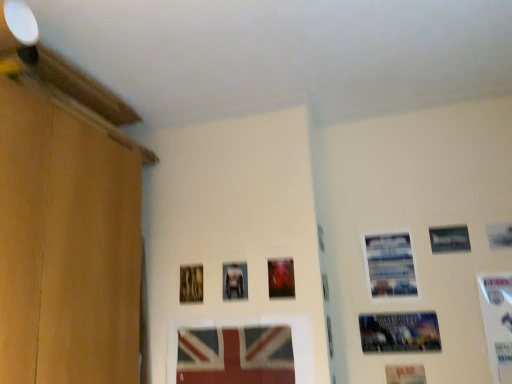
Question: Is matte plastic picture frame at center, the 8th picture frame positioned from the right, oriented away from metallic silver picture frame at center, which is counted as the third picture frame, starting from the left?

Choices:
 (A) no
 (B) yes

Answer: (A)

Question: Is the position of matte plastic picture frame at center, which is the 2th picture frame in left-to-right order, less distant than that of metallic silver picture frame at center, the 7th picture frame from the right?

Choices:
 (A) no
 (B) yes

Answer: (B)

Question: Considering the relative sizes of matte plastic picture frame at center, which is the 2th picture frame in left-to-right order, and metallic silver picture frame at center, which is counted as the third picture frame, starting from the left, in the image provided, is matte plastic picture frame at center, which is the 2th picture frame in left-to-right order, wider than metallic silver picture frame at center, which is counted as the third picture frame, starting from the left,?

Choices:
 (A) no
 (B) yes

Answer: (A)

Question: Is the position of matte plastic picture frame at center, the 8th picture frame positioned from the right, more distant than that of metallic silver picture frame at center, which is counted as the third picture frame, starting from the left?

Choices:
 (A) yes
 (B) no

Answer: (B)

Question: Does matte plastic picture frame at center, the 8th picture frame positioned from the right, have a lesser height compared to metallic silver picture frame at center, which is counted as the third picture frame, starting from the left?

Choices:
 (A) yes
 (B) no

Answer: (B)

Question: Is matte plastic picture frame at center, the 8th picture frame positioned from the right, spatially inside white glossy picture frame at right, which is counted as the ninth picture frame, starting from the left, or outside of it?

Choices:
 (A) outside
 (B) inside

Answer: (A)

Question: Considering the positions of matte plastic picture frame at center, the 8th picture frame positioned from the right, and white glossy picture frame at right, the first picture frame positioned from the right, in the image, is matte plastic picture frame at center, the 8th picture frame positioned from the right, wider or thinner than white glossy picture frame at right, the first picture frame positioned from the right,?

Choices:
 (A) wide
 (B) thin

Answer: (B)

Question: From their relative heights in the image, would you say matte plastic picture frame at center, the 8th picture frame positioned from the right, is taller or shorter than white glossy picture frame at right, which is counted as the ninth picture frame, starting from the left?

Choices:
 (A) short
 (B) tall

Answer: (A)

Question: Based on their positions, is matte plastic picture frame at center, the 8th picture frame positioned from the right, located to the left or right of white glossy picture frame at right, which is counted as the ninth picture frame, starting from the left?

Choices:
 (A) left
 (B) right

Answer: (A)

Question: Based on their positions, is metallic silver picture frame at center, the 7th picture frame from the right, located to the left or right of metallic silver picture frame at upper right, the 7th picture frame from the left?

Choices:
 (A) left
 (B) right

Answer: (A)

Question: Considering the positions of metallic silver picture frame at center, which is counted as the third picture frame, starting from the left, and metallic silver picture frame at upper right, the 3th picture frame in the right-to-left sequence, in the image, is metallic silver picture frame at center, which is counted as the third picture frame, starting from the left, taller or shorter than metallic silver picture frame at upper right, the 3th picture frame in the right-to-left sequence,?

Choices:
 (A) short
 (B) tall

Answer: (B)

Question: In terms of size, does metallic silver picture frame at center, the 7th picture frame from the right, appear bigger or smaller than metallic silver picture frame at upper right, the 3th picture frame in the right-to-left sequence?

Choices:
 (A) big
 (B) small

Answer: (A)

Question: From the image's perspective, is metallic silver picture frame at center, which is counted as the third picture frame, starting from the left, located above or below metallic silver picture frame at upper right, the 3th picture frame in the right-to-left sequence?

Choices:
 (A) below
 (B) above

Answer: (A)

Question: Considering the positions of point (212, 380) and point (433, 329), is point (212, 380) closer or farther from the camera than point (433, 329)?

Choices:
 (A) farther
 (B) closer

Answer: (B)

Question: From a real-world perspective, relative to metallic poster at lower right, which is the sixth picture frame from left to right, is matte plastic picture frame at center, which is the 2th picture frame in left-to-right order, vertically above or below?

Choices:
 (A) above
 (B) below

Answer: (B)